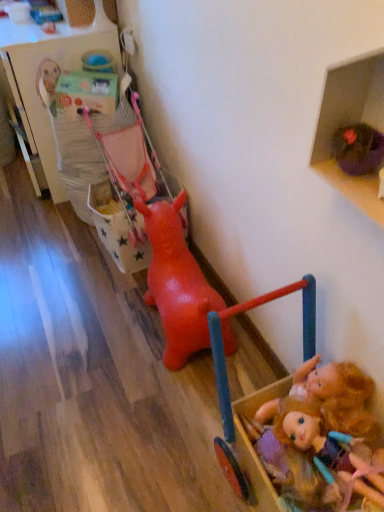
This screenshot has height=512, width=384. Find the location of `vacant region to the left of rubber dog at center, which appears as the 1th toy when viewed from the back`. vacant region to the left of rubber dog at center, which appears as the 1th toy when viewed from the back is located at coordinates (72, 328).